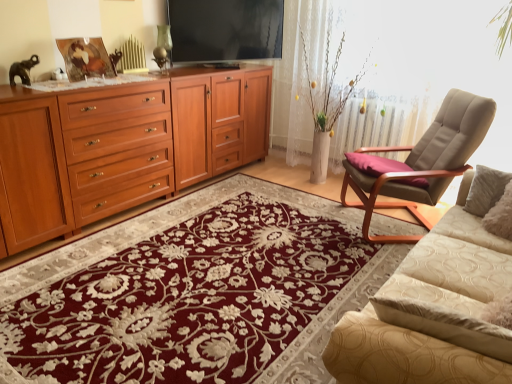
Question: From the image's perspective, is beige fabric chair at right located beneath beige textured couch at lower right?

Choices:
 (A) no
 (B) yes

Answer: (A)

Question: Is the surface of beige fabric chair at right in direct contact with beige textured couch at lower right?

Choices:
 (A) no
 (B) yes

Answer: (A)

Question: Is beige textured couch at lower right at the back of beige fabric chair at right?

Choices:
 (A) yes
 (B) no

Answer: (B)

Question: Does beige fabric chair at right lie behind beige textured couch at lower right?

Choices:
 (A) yes
 (B) no

Answer: (A)

Question: Considering the relative sizes of beige fabric chair at right and beige textured couch at lower right in the image provided, is beige fabric chair at right taller than beige textured couch at lower right?

Choices:
 (A) no
 (B) yes

Answer: (B)

Question: From a real-world perspective, does beige fabric chair at right sit lower than beige textured couch at lower right?

Choices:
 (A) no
 (B) yes

Answer: (B)

Question: Could you tell me if floral carpet at center is turned towards flat screen tv at upper center?

Choices:
 (A) yes
 (B) no

Answer: (B)

Question: Is floral carpet at center positioned beyond the bounds of flat screen tv at upper center?

Choices:
 (A) no
 (B) yes

Answer: (B)

Question: Does floral carpet at center have a lesser width compared to flat screen tv at upper center?

Choices:
 (A) no
 (B) yes

Answer: (A)

Question: From the image's perspective, is floral carpet at center above flat screen tv at upper center?

Choices:
 (A) yes
 (B) no

Answer: (B)

Question: Does floral carpet at center have a greater height compared to flat screen tv at upper center?

Choices:
 (A) no
 (B) yes

Answer: (A)

Question: Is floral carpet at center at the right side of flat screen tv at upper center?

Choices:
 (A) yes
 (B) no

Answer: (A)

Question: Is beige textured couch at lower right further to the viewer compared to metallic gold picture frame at upper left?

Choices:
 (A) yes
 (B) no

Answer: (B)